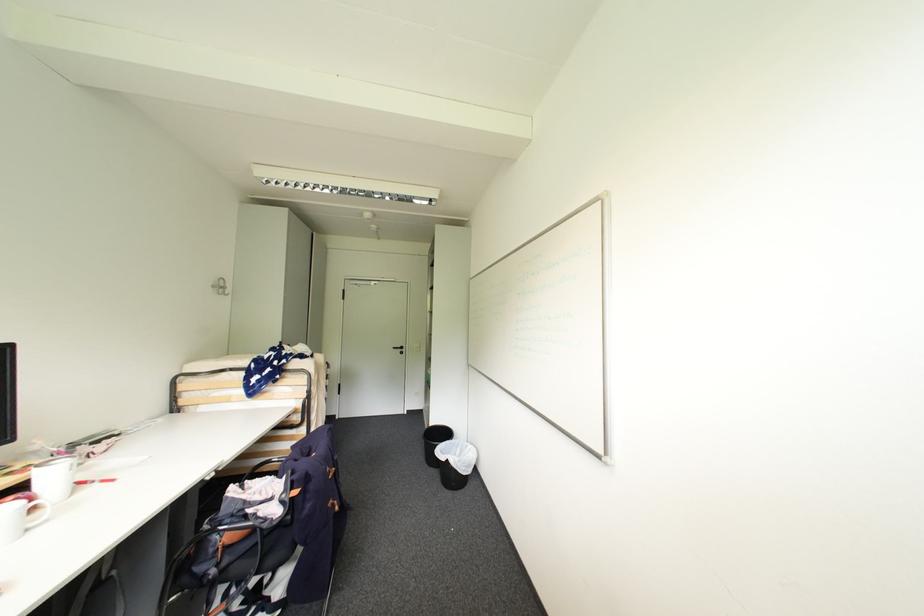
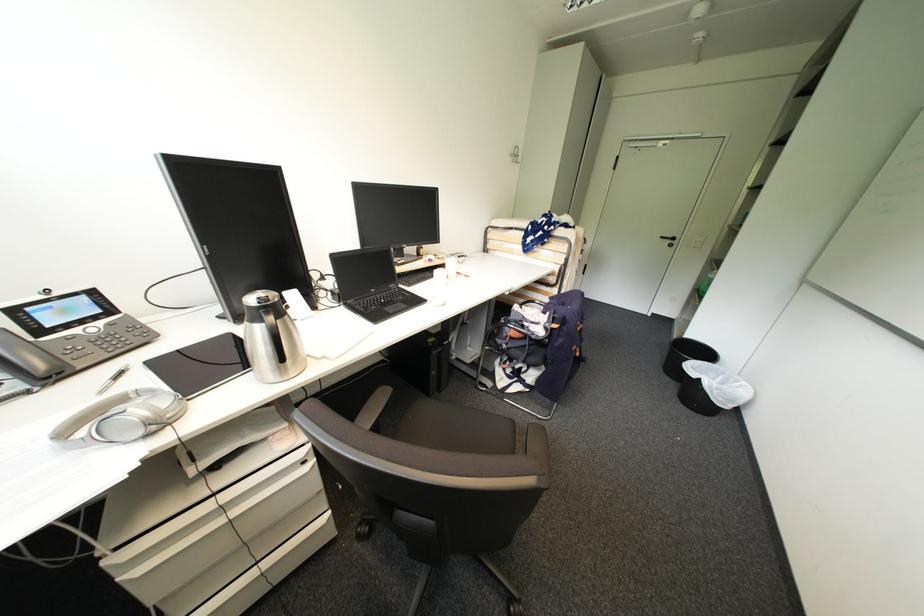
First-person continuous shooting, in which direction is the camera rotating?

The camera's rotation is toward left-down.